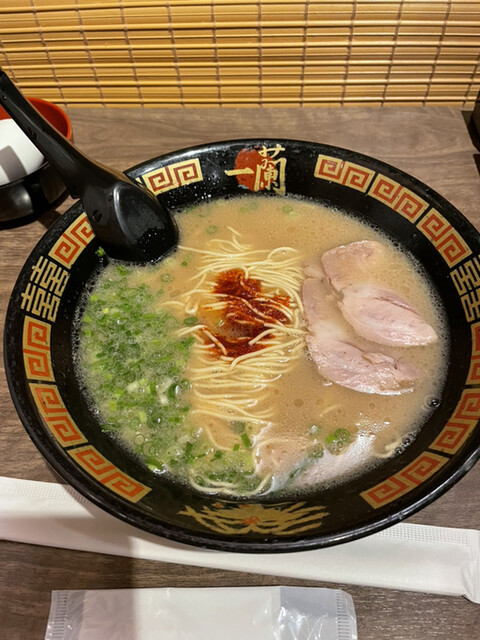
Identify the location of partial shadow on the table of the soup spoon on the top left of the photo. tap(52, 217).